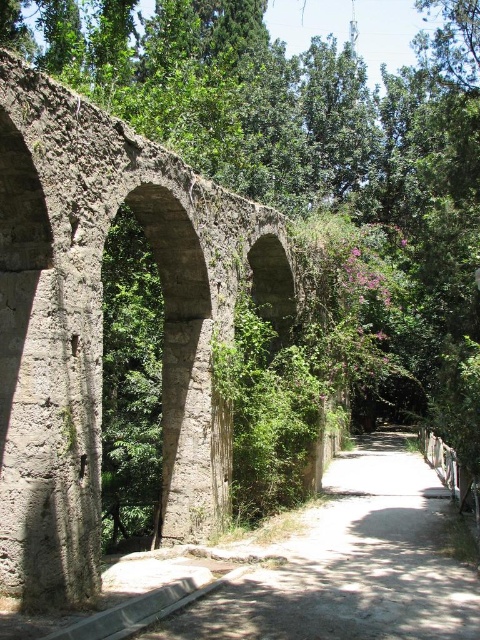
Question: Is rusty concrete arch bridge at center wider than dirt path at center?

Choices:
 (A) no
 (B) yes

Answer: (A)

Question: Which object is closer to the camera taking this photo?

Choices:
 (A) rusty concrete arch bridge at center
 (B) dirt path at center

Answer: (B)

Question: Which of the following is the closest to the observer?

Choices:
 (A) rusty concrete arch bridge at center
 (B) dirt path at center

Answer: (B)

Question: Can you confirm if rusty concrete arch bridge at center is wider than dirt path at center?

Choices:
 (A) yes
 (B) no

Answer: (B)

Question: Among these objects, which one is farthest from the camera?

Choices:
 (A) rusty concrete arch bridge at center
 (B) dirt path at center

Answer: (A)

Question: Is rusty concrete arch bridge at center positioned before dirt path at center?

Choices:
 (A) no
 (B) yes

Answer: (A)